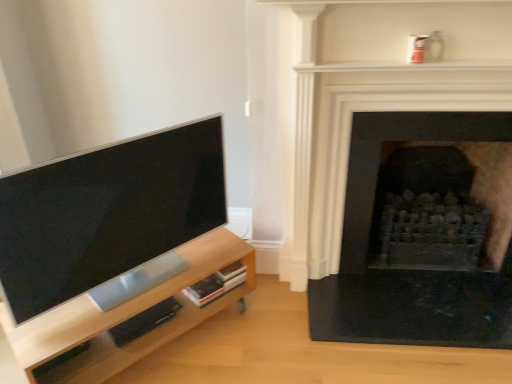
Question: From their relative heights in the image, would you say light wood entertainment center at left is taller or shorter than black stone fireplace at right, which appears as the 1th fireplace when viewed from the front?

Choices:
 (A) short
 (B) tall

Answer: (A)

Question: From the image's perspective, is light wood entertainment center at left above or below black stone fireplace at right, marked as the 2th fireplace in a back-to-front arrangement?

Choices:
 (A) below
 (B) above

Answer: (A)

Question: Estimate the real-world distances between objects in this image. Which object is closer to the matte black tv at left?

Choices:
 (A) black stone fireplace at right, the second fireplace positioned from the front
 (B) light wood entertainment center at left
 (C) black stone fireplace at right, which appears as the 1th fireplace when viewed from the front

Answer: (B)

Question: Which object is the closest to the matte black tv at left?

Choices:
 (A) black stone fireplace at right, the first fireplace positioned from the back
 (B) black stone fireplace at right, marked as the 2th fireplace in a back-to-front arrangement
 (C) light wood entertainment center at left

Answer: (C)